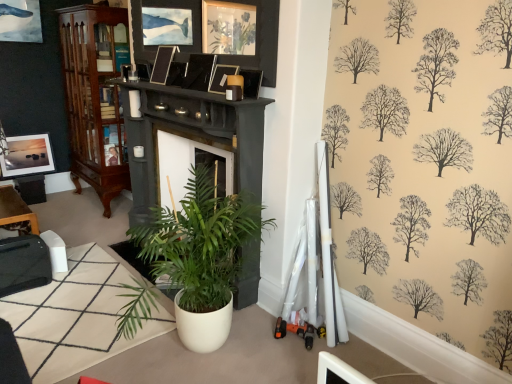
The width and height of the screenshot is (512, 384). I want to click on satin black picture frame at upper center, the second picture frame when ordered from left to right, so click(162, 64).

Measure the distance between matte black picture frame at upper center, the 3th picture frame viewed from the back, and camera.

The depth of matte black picture frame at upper center, the 3th picture frame viewed from the back, is 9.09 feet.

Find the location of a particular element. The image size is (512, 384). matte black picture frame at upper center, the 3th picture frame viewed from the back is located at coordinates (176, 74).

What do you see at coordinates (200, 256) in the screenshot?
I see `white matte houseplant at center` at bounding box center [200, 256].

Describe the element at coordinates (199, 72) in the screenshot. The height and width of the screenshot is (384, 512). I see `black glossy picture frame at upper center, which is counted as the 4th picture frame, starting from the back` at that location.

How much space does black glossy picture frame at upper center, the 2th picture frame viewed from the right, occupy horizontally?

black glossy picture frame at upper center, the 2th picture frame viewed from the right, is 3.60 inches wide.

Describe the element at coordinates (221, 77) in the screenshot. I see `matte black picture frame at upper center, placed as the 1th picture frame when sorted from right to left` at that location.

Measure the distance between point (42, 149) and camera.

A distance of 4.51 meters exists between point (42, 149) and camera.

Describe the element at coordinates (27, 156) in the screenshot. I see `matte silver picture frame at upper left, arranged as the 5th picture frame when viewed from the right` at that location.

Find the location of `brown wood cabinet at left`. brown wood cabinet at left is located at coordinates (94, 98).

From the image's perspective, is white matte rug at lower left above matte black picture frame at upper center, positioned as the 1th picture frame in front-to-back order?

No.

Is white matte rug at lower left in contact with matte black picture frame at upper center, the fifth picture frame positioned from the back?

Answer: white matte rug at lower left is not next to matte black picture frame at upper center, the fifth picture frame positioned from the back, and they're not touching.

How different are the orientations of white matte rug at lower left and matte black picture frame at upper center, placed as the 1th picture frame when sorted from right to left, in degrees?

The facing directions of white matte rug at lower left and matte black picture frame at upper center, placed as the 1th picture frame when sorted from right to left, are 1.78 degrees apart.

Between white matte rug at lower left and matte black picture frame at upper center, which appears as the 5th picture frame when viewed from the left, which one appears on the right side from the viewer's perspective?

Positioned to the right is matte black picture frame at upper center, which appears as the 5th picture frame when viewed from the left.

Identify the location of cabinetry above the white matte rug at lower left (from a real-world perspective). The width and height of the screenshot is (512, 384). pyautogui.click(x=94, y=98).

Looking at this image, is the depth of white matte rug at lower left greater than that of brown wood cabinet at left?

No, white matte rug at lower left is in front of brown wood cabinet at left.

Would you say white matte rug at lower left is inside or outside brown wood cabinet at left?

white matte rug at lower left is not enclosed by brown wood cabinet at left.

From a real-world perspective, between white matte rug at lower left and brown wood cabinet at left, who is vertically lower?

white matte rug at lower left is physically lower.

Considering the sizes of white matte houseplant at center and brown wood cabinet at left in the image, is white matte houseplant at center taller or shorter than brown wood cabinet at left?

white matte houseplant at center is shorter than brown wood cabinet at left.

Is white matte houseplant at center not inside brown wood cabinet at left?

Indeed, white matte houseplant at center is completely outside brown wood cabinet at left.

Is white matte houseplant at center closer to camera compared to brown wood cabinet at left?

That is True.

Looking at their sizes, would you say white matte houseplant at center is wider or thinner than brown wood cabinet at left?

white matte houseplant at center is wider than brown wood cabinet at left.

Is matte black picture frame at upper center, placed as the third picture frame when sorted from right to left, positioned with its back to black glossy picture frame at upper center, the 2th picture frame viewed from the right?

No, black glossy picture frame at upper center, the 2th picture frame viewed from the right, is not at the back of matte black picture frame at upper center, placed as the third picture frame when sorted from right to left.

Is matte black picture frame at upper center, positioned as the third picture frame in front-to-back order, next to black glossy picture frame at upper center, the 2th picture frame viewed from the right?

matte black picture frame at upper center, positioned as the third picture frame in front-to-back order, and black glossy picture frame at upper center, the 2th picture frame viewed from the right, are not in contact.

From a real-world perspective, between matte black picture frame at upper center, positioned as the third picture frame in front-to-back order, and black glossy picture frame at upper center, the 2th picture frame viewed from the right, who is vertically higher?

In real-world perspective, black glossy picture frame at upper center, the 2th picture frame viewed from the right, is above.

Is matte black picture frame at upper center, positioned as the third picture frame in front-to-back order, surrounding black glossy picture frame at upper center, positioned as the second picture frame in front-to-back order?

No, black glossy picture frame at upper center, positioned as the second picture frame in front-to-back order, is not inside matte black picture frame at upper center, positioned as the third picture frame in front-to-back order.

Choose the correct answer: Is matte silver picture frame at upper left, which ranks as the first picture frame in left-to-right order, inside matte black picture frame at upper center, the fifth picture frame positioned from the back, or outside it?

matte silver picture frame at upper left, which ranks as the first picture frame in left-to-right order, is outside matte black picture frame at upper center, the fifth picture frame positioned from the back.

Is point (12, 139) closer or farther from the camera than point (223, 68)?

Point (12, 139) is positioned farther from the camera compared to point (223, 68).

Is the surface of matte silver picture frame at upper left, which ranks as the first picture frame in left-to-right order, in direct contact with matte black picture frame at upper center, which appears as the 5th picture frame when viewed from the left?

matte silver picture frame at upper left, which ranks as the first picture frame in left-to-right order, and matte black picture frame at upper center, which appears as the 5th picture frame when viewed from the left, are clearly separated.

Is matte silver picture frame at upper left, arranged as the 5th picture frame when viewed from the right, smaller than matte black picture frame at upper center, which appears as the 5th picture frame when viewed from the left?

No, matte silver picture frame at upper left, arranged as the 5th picture frame when viewed from the right, is not smaller than matte black picture frame at upper center, which appears as the 5th picture frame when viewed from the left.

Is brown wood cabinet at left completely or partially inside matte black picture frame at upper center, the fifth picture frame positioned from the back?

No, brown wood cabinet at left is located outside of matte black picture frame at upper center, the fifth picture frame positioned from the back.

How different are the orientations of matte black picture frame at upper center, which appears as the 5th picture frame when viewed from the left, and brown wood cabinet at left in degrees?

matte black picture frame at upper center, which appears as the 5th picture frame when viewed from the left, and brown wood cabinet at left are facing 0.662 degrees away from each other.

Is matte black picture frame at upper center, the fifth picture frame positioned from the back, positioned far away from brown wood cabinet at left?

Indeed, matte black picture frame at upper center, the fifth picture frame positioned from the back, is not near brown wood cabinet at left.

From a real-world perspective, between matte black picture frame at upper center, placed as the 1th picture frame when sorted from right to left, and brown wood cabinet at left, who is vertically lower?

In real-world perspective, brown wood cabinet at left is lower.

At what (x,y) coordinates should I click in order to perform the action: click on houseplant below the matte black picture frame at upper center, the third picture frame positioned from the left (from the image's perspective). Please return your answer as a coordinate pair (x, y). The height and width of the screenshot is (384, 512). Looking at the image, I should click on (200, 256).

Considering their positions, is white matte houseplant at center located in front of or behind matte black picture frame at upper center, placed as the third picture frame when sorted from right to left?

white matte houseplant at center is in front of matte black picture frame at upper center, placed as the third picture frame when sorted from right to left.

From the image's perspective, would you say white matte houseplant at center is positioned over matte black picture frame at upper center, the third picture frame positioned from the left?

Actually, white matte houseplant at center appears below matte black picture frame at upper center, the third picture frame positioned from the left, in the image.

Is matte black picture frame at upper center, the 3th picture frame viewed from the back, completely or partially inside white matte houseplant at center?

Actually, matte black picture frame at upper center, the 3th picture frame viewed from the back, is outside white matte houseplant at center.

The width and height of the screenshot is (512, 384). I want to click on picture frame that is the 4th one when counting rightward from the white matte rug at lower left, so click(221, 77).

Image resolution: width=512 pixels, height=384 pixels. There is a white matte rug at lower left. Identify the location of cabinetry above it (from a real-world perspective). tap(94, 98).

From the image, which object appears to be nearer to matte black picture frame at upper center, the fifth picture frame positioned from the back, white matte houseplant at center or brown wood cabinet at left?

white matte houseplant at center is positioned closer to the anchor matte black picture frame at upper center, the fifth picture frame positioned from the back.

Considering their positions, is matte black picture frame at upper center, positioned as the 1th picture frame in front-to-back order, positioned closer to satin black picture frame at upper center, arranged as the 4th picture frame when viewed from the front, than black glossy picture frame at upper center, the 4th picture frame in the left-to-right sequence?

black glossy picture frame at upper center, the 4th picture frame in the left-to-right sequence, lies closer to satin black picture frame at upper center, arranged as the 4th picture frame when viewed from the front, than the other object.

When comparing their distances from satin black picture frame at upper center, which is the fourth picture frame in right-to-left order, does black glossy picture frame at upper center, which is counted as the 4th picture frame, starting from the back, or brown wood cabinet at left seem closer?

Among the two, black glossy picture frame at upper center, which is counted as the 4th picture frame, starting from the back, is located nearer to satin black picture frame at upper center, which is the fourth picture frame in right-to-left order.

Consider the image. Estimate the real-world distances between objects in this image. Which object is closer to satin black picture frame at upper center, the 2th picture frame when ordered from back to front, white matte rug at lower left or brown wood cabinet at left?

brown wood cabinet at left is closer to satin black picture frame at upper center, the 2th picture frame when ordered from back to front.

Based on the photo, considering their positions, is brown wood cabinet at left positioned closer to white matte rug at lower left than matte black picture frame at upper center, placed as the third picture frame when sorted from right to left?

Among the two, brown wood cabinet at left is located nearer to white matte rug at lower left.

Considering their positions, is matte black picture frame at upper center, positioned as the 1th picture frame in front-to-back order, positioned further to black glossy picture frame at upper center, the 4th picture frame in the left-to-right sequence, than white matte rug at lower left?

Based on the image, white matte rug at lower left appears to be further to black glossy picture frame at upper center, the 4th picture frame in the left-to-right sequence.

When comparing their distances from matte black picture frame at upper center, placed as the 1th picture frame when sorted from right to left, does brown wood cabinet at left or black glossy picture frame at upper center, positioned as the second picture frame in front-to-back order, seem closer?

black glossy picture frame at upper center, positioned as the second picture frame in front-to-back order, is closer to matte black picture frame at upper center, placed as the 1th picture frame when sorted from right to left.

Which object lies further to the anchor point matte black picture frame at upper center, which appears as the 5th picture frame when viewed from the left, matte silver picture frame at upper left, which is the 1th picture frame from back to front, or black glossy picture frame at upper center, which is counted as the 4th picture frame, starting from the back?

matte silver picture frame at upper left, which is the 1th picture frame from back to front, lies further to matte black picture frame at upper center, which appears as the 5th picture frame when viewed from the left, than the other object.

Where is `houseplant between matte black picture frame at upper center, positioned as the third picture frame in front-to-back order, and white matte rug at lower left in the up-down direction`? The image size is (512, 384). houseplant between matte black picture frame at upper center, positioned as the third picture frame in front-to-back order, and white matte rug at lower left in the up-down direction is located at coordinates (200, 256).

The height and width of the screenshot is (384, 512). Find the location of `picture frame between matte silver picture frame at upper left, which is the 1th picture frame from back to front, and matte black picture frame at upper center, placed as the third picture frame when sorted from right to left, in the horizontal direction`. picture frame between matte silver picture frame at upper left, which is the 1th picture frame from back to front, and matte black picture frame at upper center, placed as the third picture frame when sorted from right to left, in the horizontal direction is located at coordinates (162, 64).

Identify the location of houseplant between black glossy picture frame at upper center, which is counted as the 4th picture frame, starting from the back, and white matte rug at lower left, in the vertical direction. The width and height of the screenshot is (512, 384). (200, 256).

Image resolution: width=512 pixels, height=384 pixels. I want to click on picture frame located between black glossy picture frame at upper center, the 2th picture frame viewed from the right, and satin black picture frame at upper center, the second picture frame when ordered from left to right, in the depth direction, so click(176, 74).